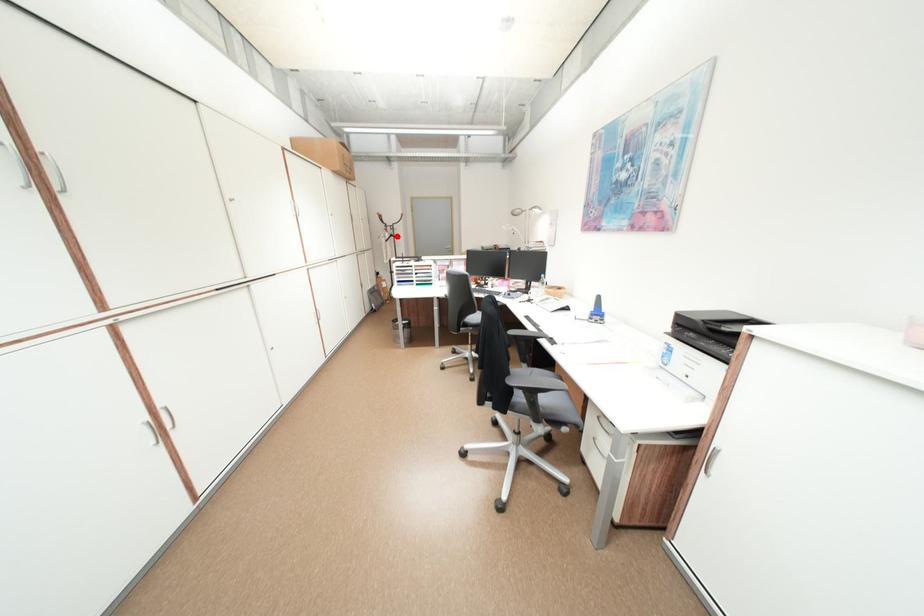
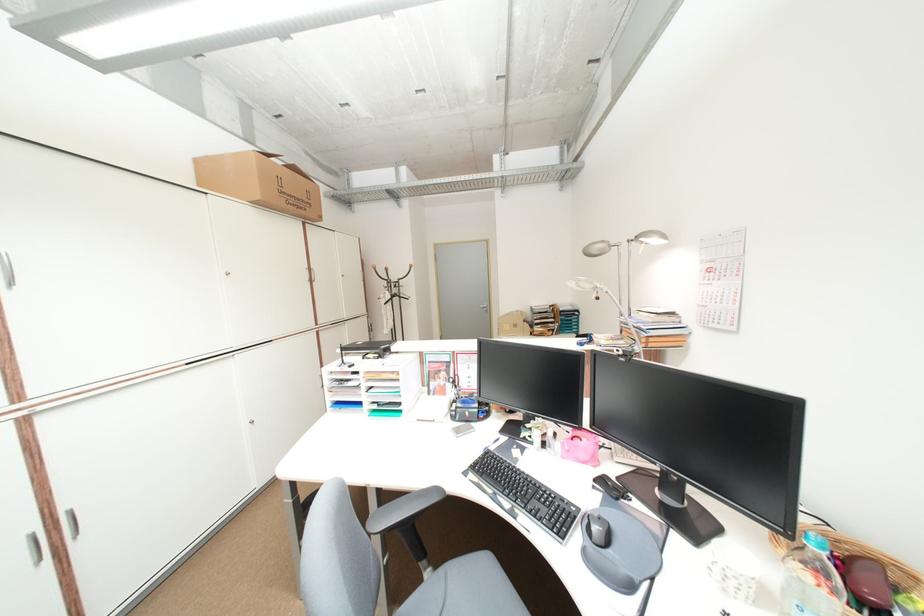
Locate, in the second image, the point that corresponds to the highlighted location in the first image.

(397, 296)